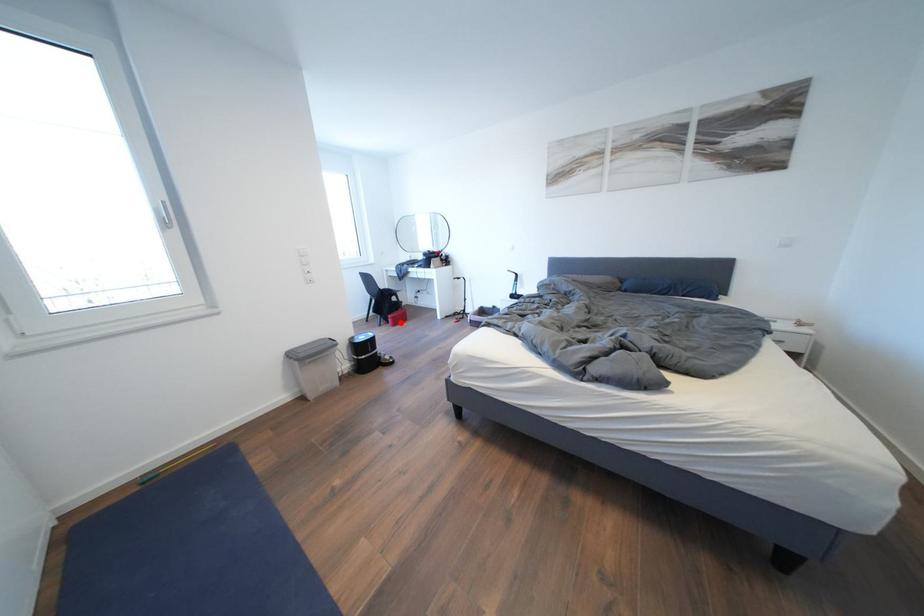
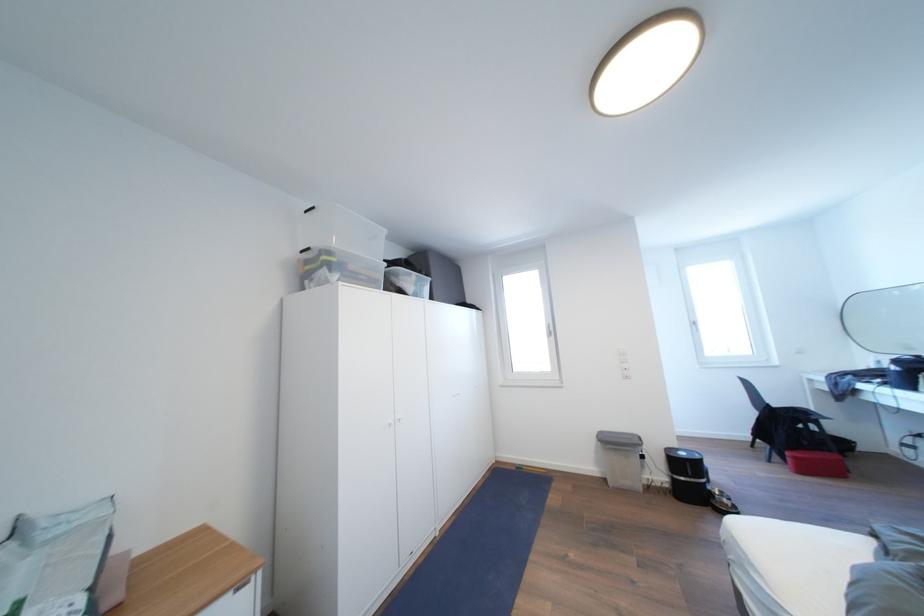
The point at the highlighted location is marked in the first image. Where is the corresponding point in the second image?

(803, 463)